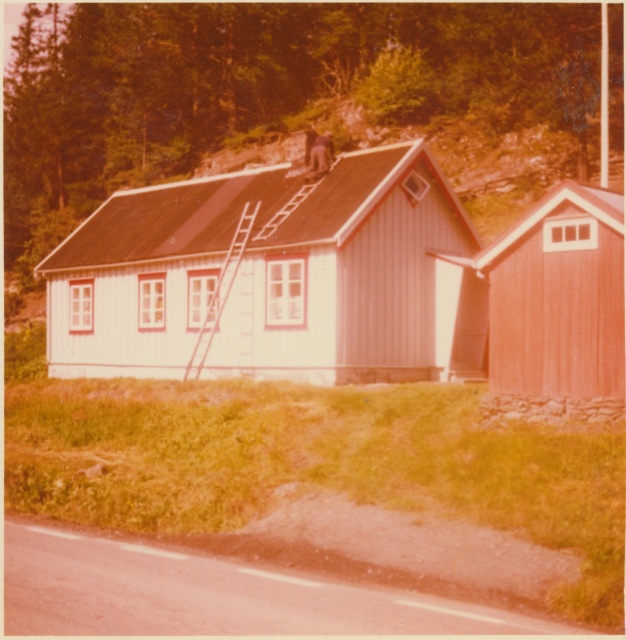
You are standing at the point marked by the coordinates point (434, 179) in a rural area with two small wooden buildings. You want to walk to the nearest building. Which building should you go to?

The point (434, 179) is 26.17 meters away from the viewer. However, without knowing the distance between the two buildings and the point, it is impossible to determine which building is closer. Please provide more information.

You are a delivery person trying to park your 2.5 meter wide truck between the white wooden hut at center and the smooth wooden shed at right. Based on the scene, can you fit your truck there?

The white wooden hut at center is wider than the smooth wooden shed at right. Since the truck is 2.5 meters wide, it depends on the combined space between them. However, without knowing the exact distance between the two structures, we cannot confirm if there is enough space for the truck.